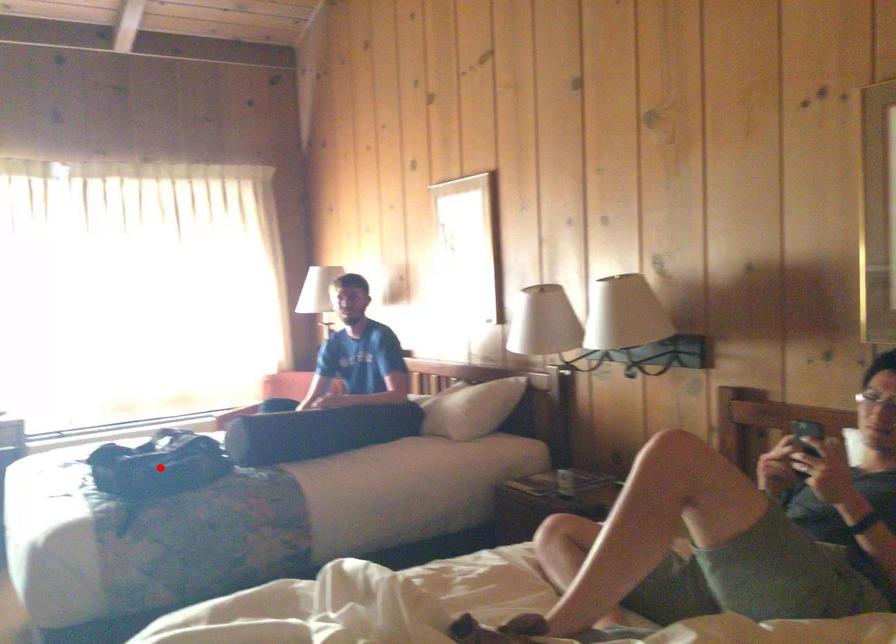
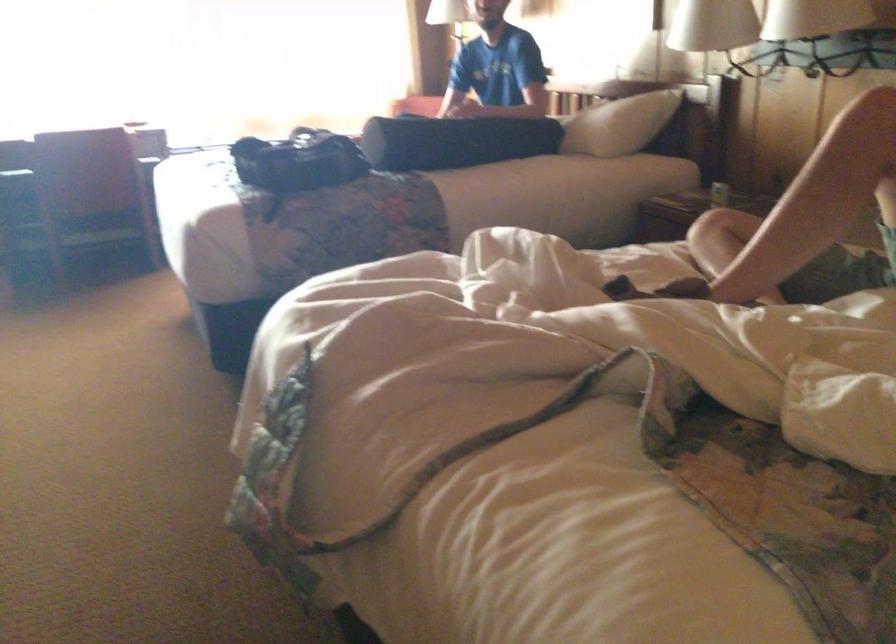
Find the pixel in the second image that matches the highlighted location in the first image.

(297, 161)